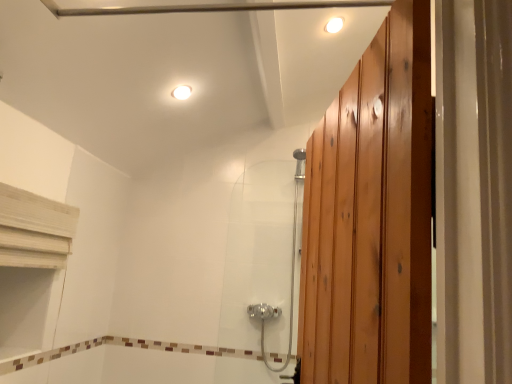
Question: Which direction should I rotate to face white glossy light fixture at upper center, marked as the first light fixture in a top-to-bottom arrangement, — up or down?

Choices:
 (A) up
 (B) down

Answer: (A)

Question: Does white glossy light fixture at upper center, positioned as the 2th light fixture in right-to-left order, have a lesser height compared to satin chrome shower door at center?

Choices:
 (A) yes
 (B) no

Answer: (A)

Question: Is white glossy light fixture at upper center, which ranks as the second light fixture in top-to-bottom order, further to camera compared to satin chrome shower door at center?

Choices:
 (A) no
 (B) yes

Answer: (A)

Question: From the image's perspective, would you say white glossy light fixture at upper center, which ranks as the second light fixture in top-to-bottom order, is shown under satin chrome shower door at center?

Choices:
 (A) yes
 (B) no

Answer: (B)

Question: From a real-world perspective, is white glossy light fixture at upper center, placed as the 1th light fixture when sorted from bottom to top, physically above satin chrome shower door at center?

Choices:
 (A) yes
 (B) no

Answer: (A)

Question: Is white glossy light fixture at upper center, which is counted as the 1th light fixture, starting from the left, placed right next to satin chrome shower door at center?

Choices:
 (A) no
 (B) yes

Answer: (A)

Question: Does white glossy light fixture at upper center, which ranks as the second light fixture in top-to-bottom order, have a larger size compared to satin chrome shower door at center?

Choices:
 (A) no
 (B) yes

Answer: (A)

Question: From the image's perspective, is satin chrome shower door at center located beneath white glossy light fixture at upper center, positioned as the 2th light fixture in right-to-left order?

Choices:
 (A) yes
 (B) no

Answer: (A)

Question: Is satin chrome shower door at center to the left of white glossy light fixture at upper center, which is counted as the 1th light fixture, starting from the left, from the viewer's perspective?

Choices:
 (A) no
 (B) yes

Answer: (A)

Question: From the image's perspective, does satin chrome shower door at center appear higher than white glossy light fixture at upper center, placed as the 1th light fixture when sorted from bottom to top?

Choices:
 (A) no
 (B) yes

Answer: (A)

Question: Considering the relative sizes of satin chrome shower door at center and white glossy light fixture at upper center, which is counted as the 1th light fixture, starting from the left, in the image provided, is satin chrome shower door at center taller than white glossy light fixture at upper center, which is counted as the 1th light fixture, starting from the left,?

Choices:
 (A) yes
 (B) no

Answer: (A)

Question: Is satin chrome shower door at center beside white glossy light fixture at upper center, which ranks as the second light fixture in top-to-bottom order?

Choices:
 (A) yes
 (B) no

Answer: (B)

Question: Considering the relative sizes of satin chrome shower door at center and white glossy light fixture at upper center, which is counted as the 1th light fixture, starting from the left, in the image provided, is satin chrome shower door at center shorter than white glossy light fixture at upper center, which is counted as the 1th light fixture, starting from the left,?

Choices:
 (A) yes
 (B) no

Answer: (B)

Question: Considering the relative sizes of white glossy light fixture at upper center, positioned as the 2th light fixture in right-to-left order, and white glossy light fixture at upper center, placed as the second light fixture when sorted from left to right, in the image provided, is white glossy light fixture at upper center, positioned as the 2th light fixture in right-to-left order, shorter than white glossy light fixture at upper center, placed as the second light fixture when sorted from left to right,?

Choices:
 (A) yes
 (B) no

Answer: (B)